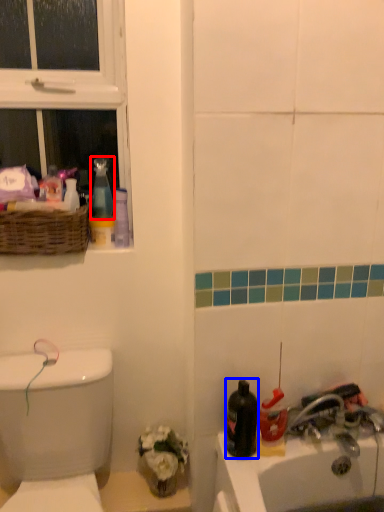
Question: Among these objects, which one is nearest to the camera, cleaning product (highlighted by a red box) or mouthwash (highlighted by a blue box)?

Choices:
 (A) cleaning product
 (B) mouthwash

Answer: (B)